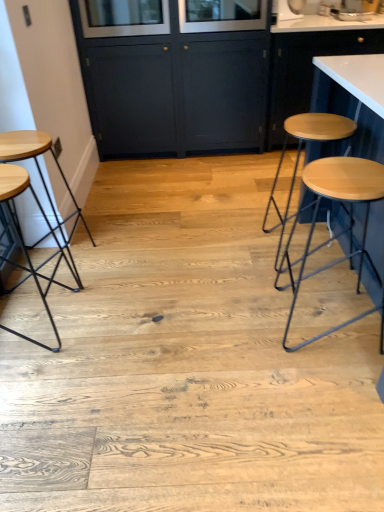
Question: From a real-world perspective, relative to white glossy countertop at upper right, the second cabinetry positioned from the left, is dark blue wood cabinet at center, marked as the second cabinetry in a right-to-left arrangement, vertically above or below?

Choices:
 (A) above
 (B) below

Answer: (A)

Question: Is dark blue wood cabinet at center, arranged as the 1th cabinetry when viewed from the left, to the left or to the right of white glossy countertop at upper right, the second cabinetry positioned from the left, in the image?

Choices:
 (A) left
 (B) right

Answer: (A)

Question: Which object is the closest to the wooden seat at left, placed as the second stool when sorted from right to left?

Choices:
 (A) clear glass window screen at upper center, placed as the first window screen when sorted from left to right
 (B) white glossy sink at upper right
 (C) white glossy countertop at upper right, the second cabinetry positioned from the left
 (D) wooden stool at right, which is the first stool from right to left
 (E) clear glass window screen at upper center, the 1th window screen positioned from the right

Answer: (A)

Question: Which of these objects is positioned farthest from the wooden seat at left, placed as the second stool when sorted from right to left?

Choices:
 (A) white glossy countertop at upper right, the first cabinetry in the right-to-left sequence
 (B) dark blue wood cabinet at center, arranged as the 1th cabinetry when viewed from the left
 (C) white glossy sink at upper right
 (D) wooden stool at right, which is the first stool from right to left
 (E) clear glass window screen at upper center, which is counted as the 2th window screen, starting from the right

Answer: (C)